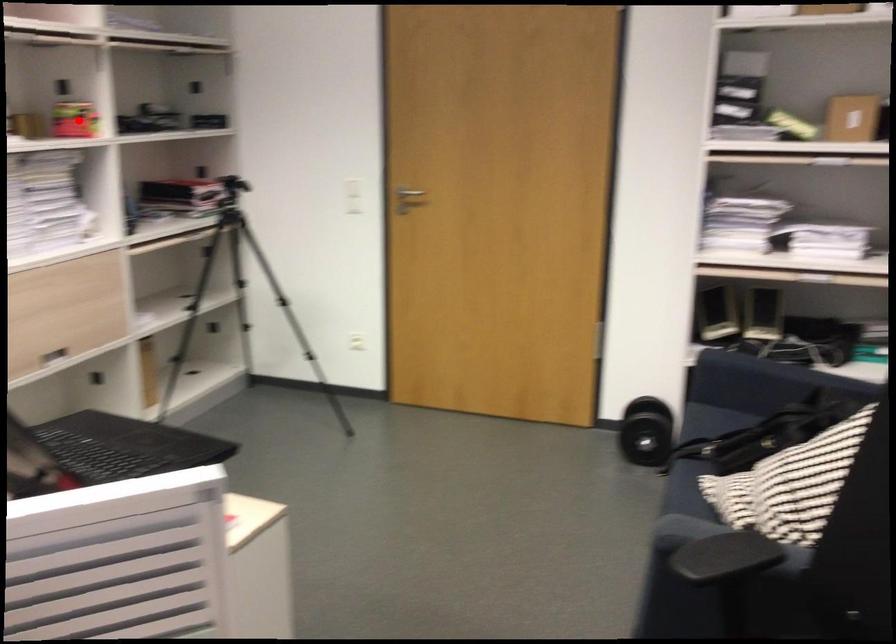
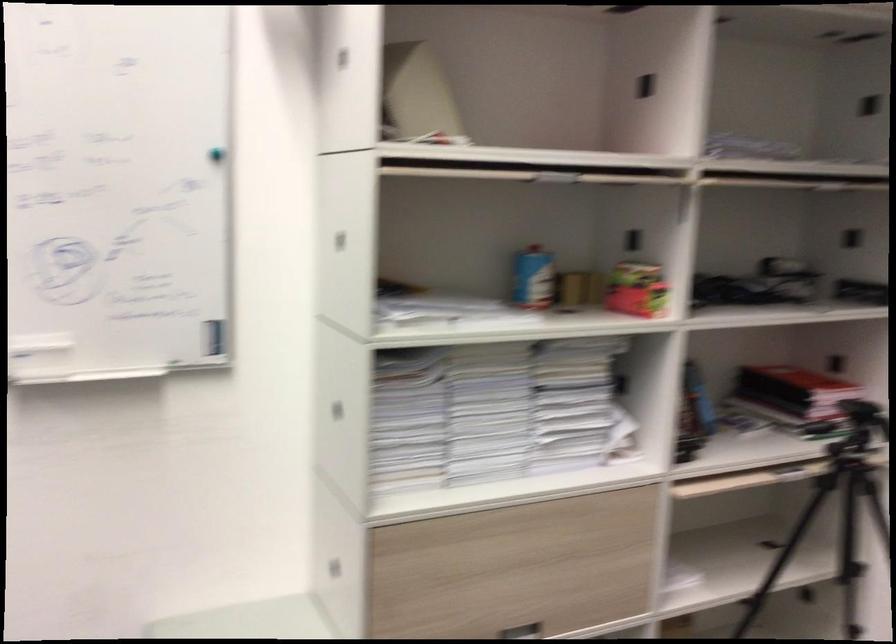
Locate, in the second image, the point that corresponds to the highlighted location in the first image.

(636, 289)